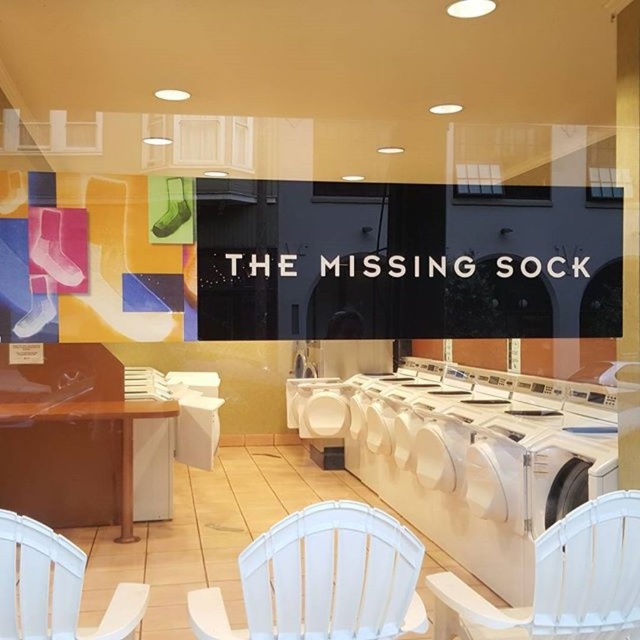
You are a customer at the laundromat and want to sit down. You see two chairs, the white plastic chair at lower right and the white plastic chair at lower left. Which chair is positioned lower in the image?

The white plastic chair at lower right is located below the white plastic chair at lower left in the image.

You are a customer in the laundromat and want to sit down. You see the white plastic washer at center and the white plastic chair at center. Which one is lower to the ground?

The white plastic chair at center is lower to the ground than the white plastic washer at center because the washer is located above it.

You are standing at the entrance of the laundromat and want to sit down. The entrance is at the lower left corner of the image. Which direction should you walk to reach the white plastic chair at lower right?

You should walk towards the lower right direction to reach the white plastic chair at lower right since it is located at point (561,580) in the image.